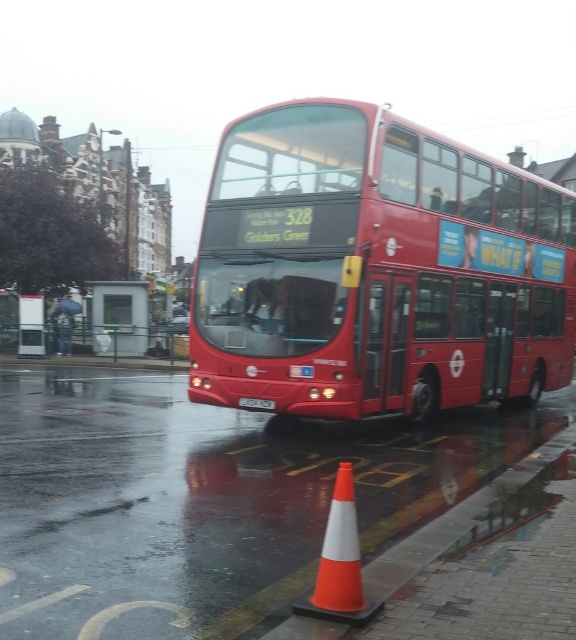
Does orange/white plastic traffic cone at lower center have a greater height compared to white plastic license plate at center?

Indeed, orange/white plastic traffic cone at lower center has a greater height compared to white plastic license plate at center.

Between orange/white plastic traffic cone at lower center and white plastic license plate at center, which one is positioned lower?

Positioned lower is orange/white plastic traffic cone at lower center.

Which is behind, point (312, 596) or point (274, 403)?

Point (274, 403)

Locate an element on the screen. The width and height of the screenshot is (576, 640). orange/white plastic traffic cone at lower center is located at coordinates (339, 563).

Which of these two, shiny red bus at center or white plastic license plate at center, stands taller?

Standing taller between the two is shiny red bus at center.

Can you confirm if shiny red bus at center is taller than white plastic license plate at center?

Indeed, shiny red bus at center has a greater height compared to white plastic license plate at center.

This screenshot has height=640, width=576. I want to click on shiny red bus at center, so click(376, 269).

Based on the photo, who is more distant from viewer, (195, 364) or (119, 310)?

Point (119, 310)

What do you see at coordinates (376, 269) in the screenshot?
I see `shiny red bus at center` at bounding box center [376, 269].

Find the location of a particular element. The height and width of the screenshot is (640, 576). shiny red bus at center is located at coordinates (376, 269).